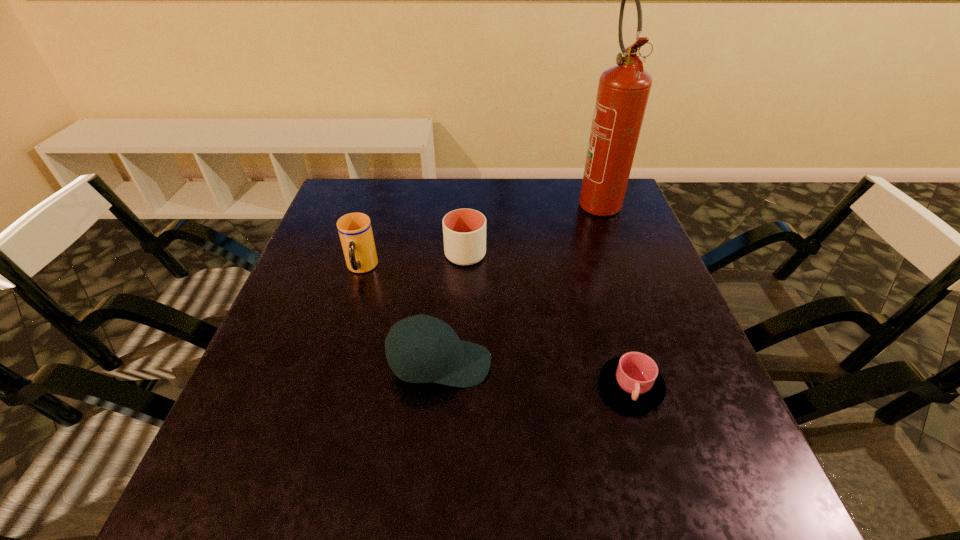
This screenshot has width=960, height=540. Find the location of `vacant space at the left edge of the desktop`. vacant space at the left edge of the desktop is located at coordinates (323, 279).

What are the coordinates of `blank space at the right edge of the desktop` in the screenshot? It's located at (699, 386).

You are a GUI agent. You are given a task and a screenshot of the screen. Output one action in this format:
    pyautogui.click(x=<x>, y=<y>)
    Task: Click on the vacant area at the far left corner of the desktop
    The height and width of the screenshot is (540, 960).
    Given the screenshot: What is the action you would take?
    pyautogui.click(x=352, y=185)

The height and width of the screenshot is (540, 960). In order to click on vacant area that lies between the tallest cup and the second cup from left to right in this screenshot , I will do `click(414, 261)`.

At what (x,y) coordinates should I click in order to perform the action: click on free space that is in between the leftmost cup and the second shortest cup. Please return your answer as a coordinate pair (x, y). This screenshot has height=540, width=960. Looking at the image, I should click on (414, 261).

In order to click on vacant point located between the second shortest cup and the rightmost cup in this screenshot , I will do `click(548, 320)`.

Locate an element on the screen. The width and height of the screenshot is (960, 540). free space between the shortest cup and the baseball cap is located at coordinates (536, 375).

Find the location of a particular element. free space between the tallest cup and the rightmost cup is located at coordinates (496, 327).

Find the location of a particular element. This screenshot has height=540, width=960. vacant area between the leftmost cup and the shortest cup is located at coordinates (496, 327).

The image size is (960, 540). Identify the location of empty location between the baseball cap and the leftmost cup. (400, 316).